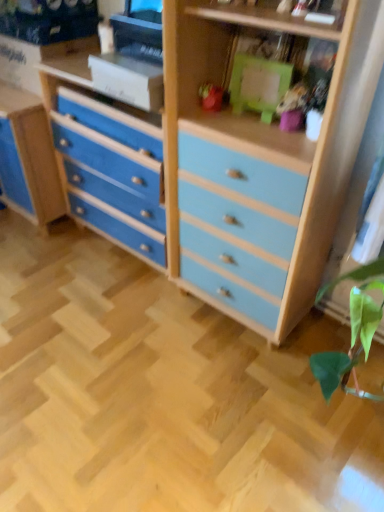
Question: In which direction should I rotate to look at matte pink toy at upper center, which appears as the first toy when viewed from the right?

Choices:
 (A) left
 (B) right

Answer: (B)

Question: Can we say matte plastic toy at center, placed as the 1th toy when sorted from left to right, lies outside matte pink toy at upper center, the 2th toy positioned from the left?

Choices:
 (A) yes
 (B) no

Answer: (A)

Question: Is the depth of matte plastic toy at center, the second toy positioned from the right, greater than that of matte pink toy at upper center, the 2th toy positioned from the left?

Choices:
 (A) yes
 (B) no

Answer: (A)

Question: From the image's perspective, is matte plastic toy at center, placed as the 1th toy when sorted from left to right, located above matte pink toy at upper center, which appears as the first toy when viewed from the right?

Choices:
 (A) no
 (B) yes

Answer: (B)

Question: Does matte plastic toy at center, the second toy positioned from the right, lie in front of matte pink toy at upper center, the 2th toy positioned from the left?

Choices:
 (A) yes
 (B) no

Answer: (B)

Question: Can you confirm if matte plastic toy at center, placed as the 1th toy when sorted from left to right, is bigger than matte pink toy at upper center, the 2th toy positioned from the left?

Choices:
 (A) yes
 (B) no

Answer: (B)

Question: Is matte plastic toy at center, placed as the 1th toy when sorted from left to right, to the left of matte pink toy at upper center, the 2th toy positioned from the left, from the viewer's perspective?

Choices:
 (A) no
 (B) yes

Answer: (B)

Question: Can you confirm if matte pink toy at upper center, the 2th toy positioned from the left, is positioned to the right of matte plastic toy at center, the second toy positioned from the right?

Choices:
 (A) no
 (B) yes

Answer: (B)

Question: From a real-world perspective, is matte pink toy at upper center, which appears as the first toy when viewed from the right, beneath matte plastic toy at center, placed as the 1th toy when sorted from left to right?

Choices:
 (A) no
 (B) yes

Answer: (A)

Question: Is matte pink toy at upper center, the 2th toy positioned from the left, far away from matte plastic toy at center, placed as the 1th toy when sorted from left to right?

Choices:
 (A) no
 (B) yes

Answer: (A)

Question: Is matte pink toy at upper center, the 2th toy positioned from the left, outside matte plastic toy at center, the second toy positioned from the right?

Choices:
 (A) yes
 (B) no

Answer: (A)

Question: Can you confirm if matte pink toy at upper center, the 2th toy positioned from the left, is bigger than matte plastic toy at center, placed as the 1th toy when sorted from left to right?

Choices:
 (A) yes
 (B) no

Answer: (A)

Question: Can you confirm if matte pink toy at upper center, the 2th toy positioned from the left, is shorter than matte plastic toy at center, placed as the 1th toy when sorted from left to right?

Choices:
 (A) no
 (B) yes

Answer: (A)

Question: Is point (301, 106) positioned closer to the camera than point (218, 106)?

Choices:
 (A) farther
 (B) closer

Answer: (B)